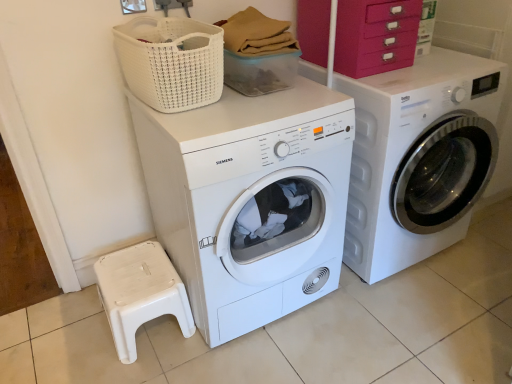
The image size is (512, 384). Find the location of `white plastic step stool at lower left`. white plastic step stool at lower left is located at coordinates (140, 293).

This screenshot has width=512, height=384. What are the coordinates of `white matte washing machine at center, which is the 1th washing machine from left to right` in the screenshot? It's located at (248, 199).

In order to click on washing machine that appears on the left of white glossy washing machine at right, which appears as the 1th washing machine when viewed from the right in this screenshot , I will do `click(248, 199)`.

From the image's perspective, between white matte washing machine at center, which is the 1th washing machine from left to right, and white glossy washing machine at right, the 2th washing machine from the left, who is located below?

From the image's view, white matte washing machine at center, which is the 1th washing machine from left to right, is below.

Which is more to the left, white matte washing machine at center, which is counted as the second washing machine, starting from the right, or white glossy washing machine at right, which appears as the 1th washing machine when viewed from the right?

white matte washing machine at center, which is counted as the second washing machine, starting from the right, is more to the left.

From the picture: Considering the sizes of objects white matte washing machine at center, which is the 1th washing machine from left to right, and white woven basket at upper center in the image provided, who is wider, white matte washing machine at center, which is the 1th washing machine from left to right, or white woven basket at upper center?

With larger width is white matte washing machine at center, which is the 1th washing machine from left to right.

The height and width of the screenshot is (384, 512). Find the location of `washing machine that is the 2nd object directly below the white woven basket at upper center (from a real-world perspective)`. washing machine that is the 2nd object directly below the white woven basket at upper center (from a real-world perspective) is located at coordinates (248, 199).

Would you say white matte washing machine at center, which is the 1th washing machine from left to right, is outside white woven basket at upper center?

Yes, white matte washing machine at center, which is the 1th washing machine from left to right, is outside of white woven basket at upper center.

Which is more distant, [310,102] or [146,62]?

The point [310,102] is behind.

Considering the sizes of objects white woven basket at upper center and pink plastic drawers at upper right in the image provided, who is taller, white woven basket at upper center or pink plastic drawers at upper right?

pink plastic drawers at upper right.

Between point (156, 76) and point (384, 8), which one is positioned in front?

The point (156, 76) is closer to the camera.

Looking at this image, considering the positions of objects white woven basket at upper center and pink plastic drawers at upper right in the image provided, who is behind, white woven basket at upper center or pink plastic drawers at upper right?

pink plastic drawers at upper right is more distant.

From a real-world perspective, is white woven basket at upper center on pink plastic drawers at upper right?

No, from a real-world perspective, white woven basket at upper center is not over pink plastic drawers at upper right

Which is correct: white plastic step stool at lower left is inside white woven basket at upper center, or outside of it?

white plastic step stool at lower left is not enclosed by white woven basket at upper center.

Can you see white plastic step stool at lower left touching white woven basket at upper center?

white plastic step stool at lower left and white woven basket at upper center are not in contact.

From a real-world perspective, between white plastic step stool at lower left and white woven basket at upper center, who is vertically higher?

white woven basket at upper center, from a real-world perspective.

Is point (180, 287) closer or farther from the camera than point (210, 87)?

Point (180, 287).

Would you say pink plastic drawers at upper right is part of white glossy washing machine at right, the 2th washing machine from the left,'s contents?

Definitely not — pink plastic drawers at upper right is not inside white glossy washing machine at right, the 2th washing machine from the left.

Between white glossy washing machine at right, which appears as the 1th washing machine when viewed from the right, and pink plastic drawers at upper right, which one has less height?

pink plastic drawers at upper right is shorter.

Which is more distant, (449, 173) or (370, 14)?

Positioned behind is point (449, 173).

Considering their positions, is white glossy washing machine at right, the 2th washing machine from the left, located in front of or behind pink plastic drawers at upper right?

Visually, white glossy washing machine at right, the 2th washing machine from the left, is located in front of pink plastic drawers at upper right.

Is white matte washing machine at center, which is counted as the second washing machine, starting from the right, completely or partially inside white plastic step stool at lower left?

No.

Which point is more distant from viewer, (109, 320) or (196, 143)?

The point (109, 320) is farther.

Image resolution: width=512 pixels, height=384 pixels. What are the coordinates of `step stool on the left of white matte washing machine at center, which is counted as the second washing machine, starting from the right` in the screenshot? It's located at (140, 293).

Is white plastic step stool at lower left oriented towards white glossy washing machine at right, which appears as the 1th washing machine when viewed from the right?

No, white plastic step stool at lower left is not facing towards white glossy washing machine at right, which appears as the 1th washing machine when viewed from the right.

Based on the photo, in terms of size, does white plastic step stool at lower left appear bigger or smaller than white glossy washing machine at right, which appears as the 1th washing machine when viewed from the right?

Considering their sizes, white plastic step stool at lower left takes up less space than white glossy washing machine at right, which appears as the 1th washing machine when viewed from the right.

Is white glossy washing machine at right, which appears as the 1th washing machine when viewed from the right, surrounded by white plastic step stool at lower left?

No, white glossy washing machine at right, which appears as the 1th washing machine when viewed from the right, is not inside white plastic step stool at lower left.

Is white plastic step stool at lower left wider or thinner than white glossy washing machine at right, which appears as the 1th washing machine when viewed from the right?

Clearly, white plastic step stool at lower left has less width compared to white glossy washing machine at right, which appears as the 1th washing machine when viewed from the right.

In order to click on washing machine above the white matte washing machine at center, which is the 1th washing machine from left to right (from the image's perspective) in this screenshot , I will do `click(419, 158)`.

In order to click on basket behind the white matte washing machine at center, which is counted as the second washing machine, starting from the right in this screenshot , I will do `click(170, 62)`.

When comparing their distances from white matte washing machine at center, which is counted as the second washing machine, starting from the right, does white plastic step stool at lower left or white glossy washing machine at right, which appears as the 1th washing machine when viewed from the right, seem closer?

white plastic step stool at lower left lies closer to white matte washing machine at center, which is counted as the second washing machine, starting from the right, than the other object.

Considering their positions, is white glossy washing machine at right, which appears as the 1th washing machine when viewed from the right, positioned further to white woven basket at upper center than white matte washing machine at center, which is counted as the second washing machine, starting from the right?

white glossy washing machine at right, which appears as the 1th washing machine when viewed from the right, lies further to white woven basket at upper center than the other object.

From the picture: Based on their spatial positions, is white woven basket at upper center or pink plastic drawers at upper right closer to white matte washing machine at center, which is the 1th washing machine from left to right?

Based on the image, white woven basket at upper center appears to be nearer to white matte washing machine at center, which is the 1th washing machine from left to right.

Which object lies further to the anchor point white glossy washing machine at right, which appears as the 1th washing machine when viewed from the right, pink plastic drawers at upper right or white matte washing machine at center, which is the 1th washing machine from left to right?

The object further to white glossy washing machine at right, which appears as the 1th washing machine when viewed from the right, is white matte washing machine at center, which is the 1th washing machine from left to right.

From the image, which object appears to be farther from white woven basket at upper center, white glossy washing machine at right, which appears as the 1th washing machine when viewed from the right, or pink plastic drawers at upper right?

white glossy washing machine at right, which appears as the 1th washing machine when viewed from the right.

Estimate the real-world distances between objects in this image. Which object is further from white matte washing machine at center, which is the 1th washing machine from left to right, pink plastic drawers at upper right or white glossy washing machine at right, the 2th washing machine from the left?

pink plastic drawers at upper right lies further to white matte washing machine at center, which is the 1th washing machine from left to right, than the other object.

Based on their spatial positions, is white matte washing machine at center, which is the 1th washing machine from left to right, or pink plastic drawers at upper right further from white plastic step stool at lower left?

The object further to white plastic step stool at lower left is pink plastic drawers at upper right.

Estimate the real-world distances between objects in this image. Which object is closer to white plastic step stool at lower left, white woven basket at upper center or white matte washing machine at center, which is the 1th washing machine from left to right?

white matte washing machine at center, which is the 1th washing machine from left to right, lies closer to white plastic step stool at lower left than the other object.

This screenshot has height=384, width=512. Identify the location of basket between pink plastic drawers at upper right and white plastic step stool at lower left in the up-down direction. (170, 62).

This screenshot has height=384, width=512. Identify the location of drawer between white plastic step stool at lower left and white glossy washing machine at right, the 2th washing machine from the left, in the horizontal direction. (375, 36).

Image resolution: width=512 pixels, height=384 pixels. I want to click on basket situated between white plastic step stool at lower left and white glossy washing machine at right, the 2th washing machine from the left, from left to right, so click(x=170, y=62).

In order to click on washing machine between pink plastic drawers at upper right and white matte washing machine at center, which is the 1th washing machine from left to right, in the vertical direction in this screenshot , I will do `click(419, 158)`.